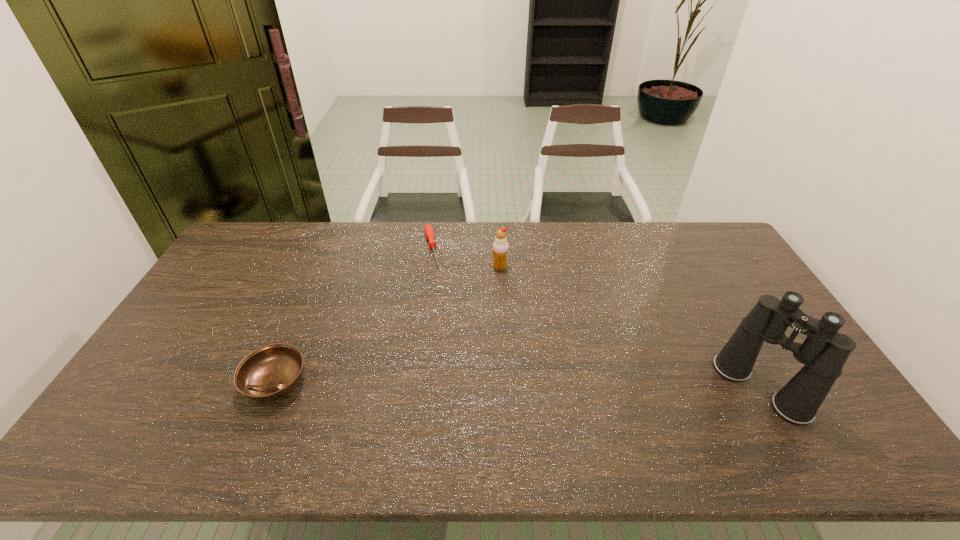
Locate an element on the screen. This screenshot has width=960, height=540. vacant spot on the desktop that is between the soup bowl and the binoculars and is positioned at the front with a straw on the second object from right to left is located at coordinates (475, 385).

Locate an element on the screen. The image size is (960, 540). free space on the desktop that is between the third tallest object and the rightmost object and is positioned at the tip of the screwdriver is located at coordinates (466, 384).